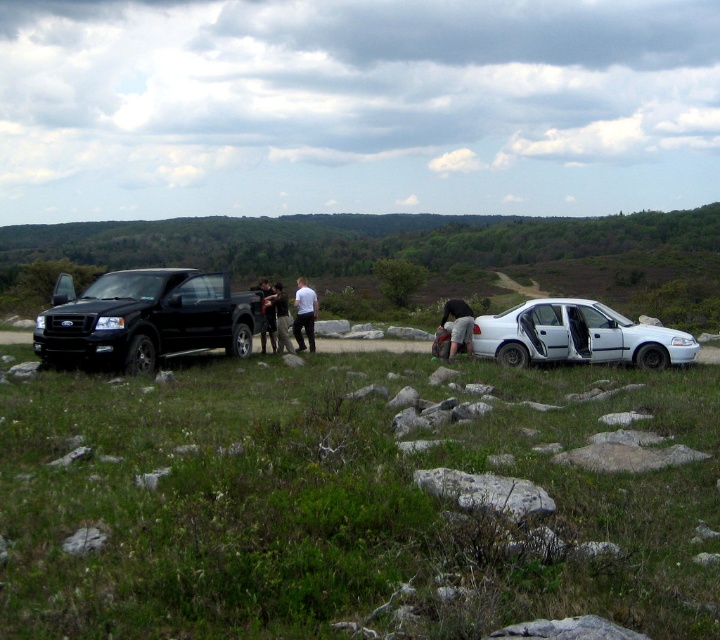
Based on the photo, which is above, dark gray fabric pants at center or dark gray fabric jacket at center?

dark gray fabric jacket at center

Consider the image. Is the position of dark gray fabric pants at center less distant than that of dark gray fabric jacket at center?

Yes, it is in front of dark gray fabric jacket at center.

This screenshot has width=720, height=640. What do you see at coordinates (458, 324) in the screenshot? I see `dark gray fabric pants at center` at bounding box center [458, 324].

At what (x,y) coordinates should I click in order to perform the action: click on dark gray fabric pants at center. Please return your answer as a coordinate pair (x, y). This screenshot has width=720, height=640. Looking at the image, I should click on (458, 324).

Between point (276, 332) and point (264, 342), which one is positioned in front?

Point (276, 332) is more forward.

Where is `camouflage pants at center`? The height and width of the screenshot is (640, 720). camouflage pants at center is located at coordinates pyautogui.click(x=279, y=316).

Locate an element on the screen. camouflage pants at center is located at coordinates pyautogui.click(x=279, y=316).

Is black matte truck at left below white matte shirt at center?

Indeed, black matte truck at left is positioned under white matte shirt at center.

Does black matte truck at left appear over white matte shirt at center?

Incorrect, black matte truck at left is not positioned above white matte shirt at center.

Is point (45, 320) positioned behind point (296, 308)?

No.

Find the location of a particular element. black matte truck at left is located at coordinates (144, 317).